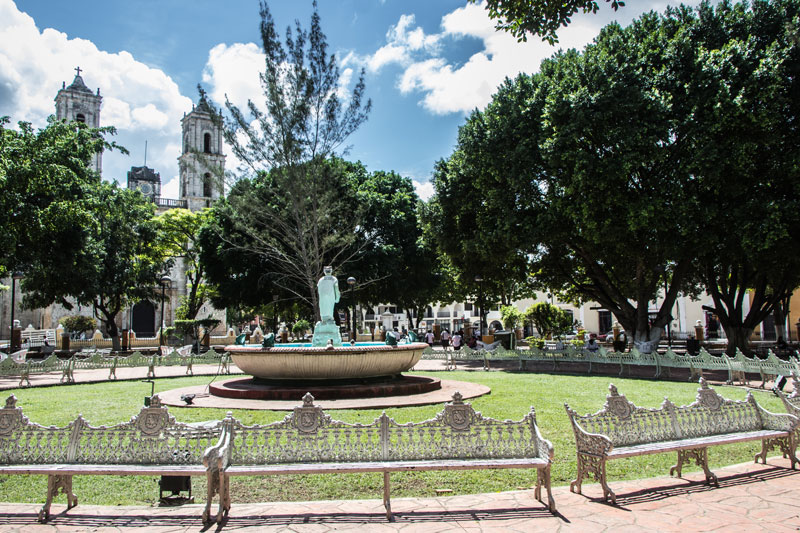
The height and width of the screenshot is (533, 800). In order to click on benches in this screenshot , I will do `click(130, 455)`, `click(32, 454)`, `click(364, 450)`, `click(694, 425)`.